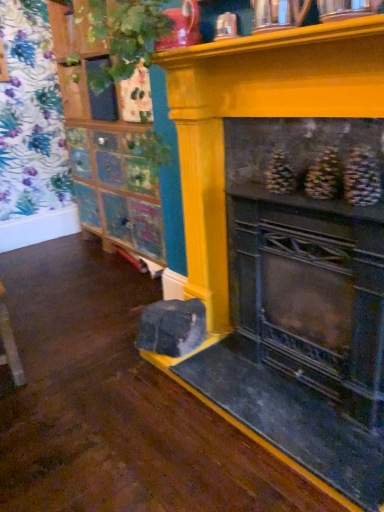
Question: From the image's perspective, relative to multicolored painted cabinet at left, the first shelf viewed from the left, is yellow painted wood fireplace at center above or below?

Choices:
 (A) below
 (B) above

Answer: (A)

Question: In terms of width, does yellow painted wood fireplace at center look wider or thinner when compared to multicolored painted cabinet at left, the first shelf viewed from the left?

Choices:
 (A) thin
 (B) wide

Answer: (A)

Question: Estimate the real-world distances between objects in this image. Which object is closer to the multicolored painted cabinet at left, the first shelf viewed from the left?

Choices:
 (A) green leafy plant at upper left
 (B) wooden cabinet at upper left, the 1th shelf from the right
 (C) yellow painted wood fireplace at center

Answer: (B)

Question: Which object is positioned farthest from the wooden cabinet at upper left, the second shelf in the left-to-right sequence?

Choices:
 (A) yellow painted wood fireplace at center
 (B) green leafy plant at upper left
 (C) multicolored painted cabinet at left, the first shelf viewed from the left

Answer: (B)